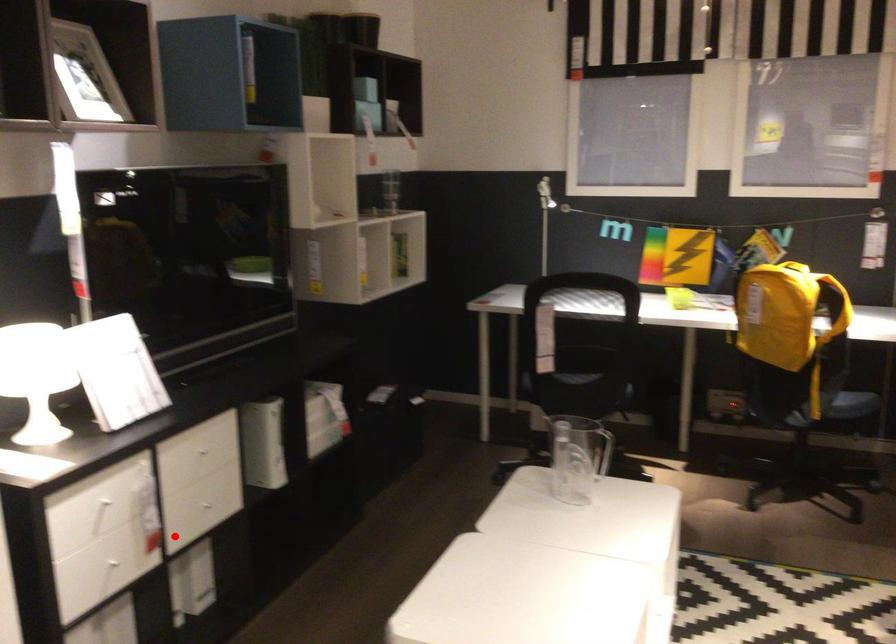
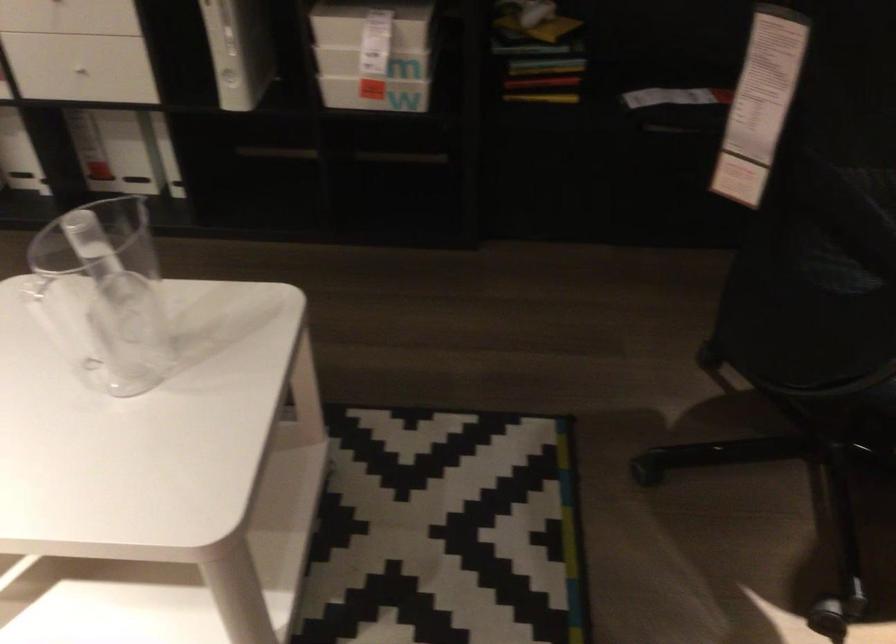
Question: I am providing you with two images of the same scene from different viewpoints. In image1, a red point is highlighted. Considering the same 3D point in image2, which of the following is correct?

Choices:
 (A) It is closer
 (B) It is farther

Answer: (A)